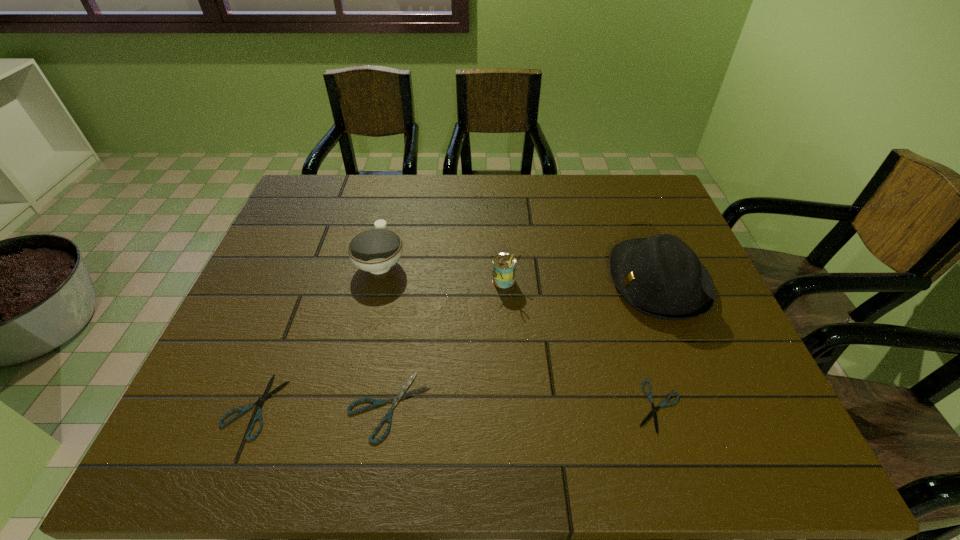
The width and height of the screenshot is (960, 540). I want to click on object located at the right edge, so click(661, 277).

At what (x,y) coordinates should I click in order to perform the action: click on object that is positioned at the near left corner. Please return your answer as a coordinate pair (x, y). The height and width of the screenshot is (540, 960). Looking at the image, I should click on (265, 396).

This screenshot has width=960, height=540. In the image, there is a desktop. What are the coordinates of `free space at the far edge` in the screenshot? It's located at (468, 187).

Find the location of a particular element. Image resolution: width=960 pixels, height=540 pixels. vacant space at the near edge of the desktop is located at coordinates (540, 375).

Locate an element on the screen. blank space at the left edge is located at coordinates (279, 266).

Find the location of `vacant space at the right edge of the desktop`. vacant space at the right edge of the desktop is located at coordinates click(633, 224).

In the image, there is a desktop. Identify the location of vacant space at the far left corner. The width and height of the screenshot is (960, 540). (310, 198).

Locate an element on the screen. Image resolution: width=960 pixels, height=540 pixels. blank space at the near left corner of the desktop is located at coordinates (215, 378).

Locate an element on the screen. This screenshot has height=540, width=960. free space at the far right corner is located at coordinates (625, 193).

Where is `free point between the shortest shears and the fifth tallest object`? free point between the shortest shears and the fifth tallest object is located at coordinates (456, 406).